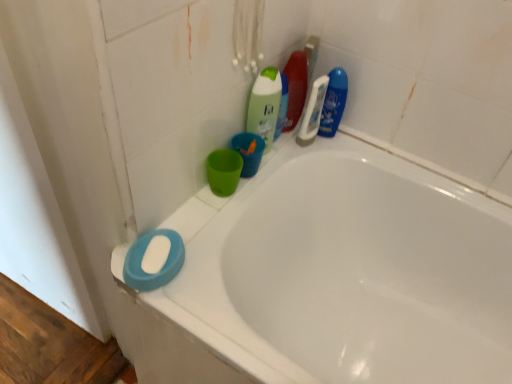
The height and width of the screenshot is (384, 512). Identify the location of free location to the right of white plastic toothbrush at upper center, the second cleaning product when ordered from right to left. (359, 151).